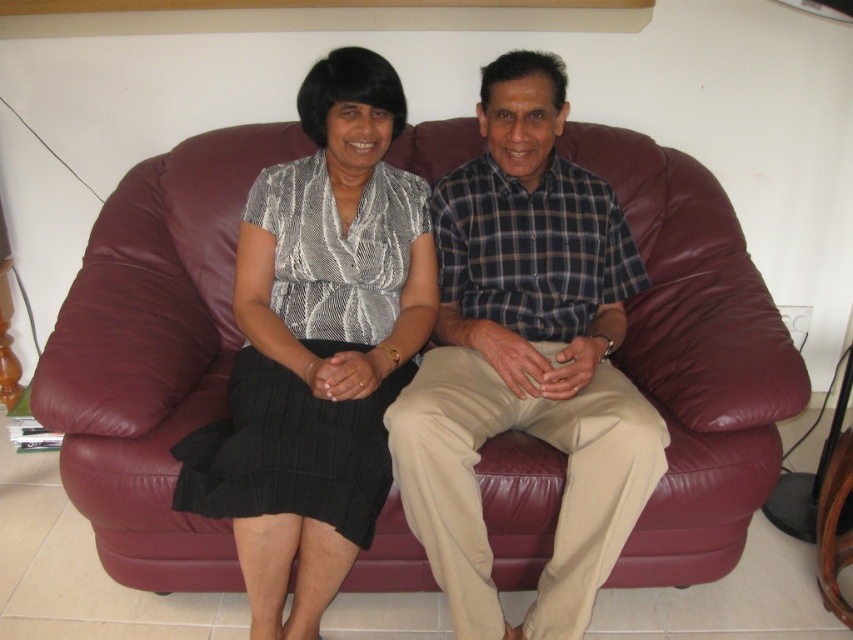
Question: Is plaid cotton shirt at center thinner than matte black dress at center?

Choices:
 (A) yes
 (B) no

Answer: (B)

Question: Estimate the real-world distances between objects in this image. Which object is closer to the matte black dress at center?

Choices:
 (A) maroon leather couch at center
 (B) plaid cotton shirt at center

Answer: (B)

Question: Estimate the real-world distances between objects in this image. Which object is closer to the matte black dress at center?

Choices:
 (A) plaid cotton shirt at center
 (B) maroon leather couch at center

Answer: (A)

Question: Where is maroon leather couch at center located in relation to plaid cotton shirt at center in the image?

Choices:
 (A) above
 (B) below

Answer: (A)

Question: Does maroon leather couch at center appear under plaid cotton shirt at center?

Choices:
 (A) no
 (B) yes

Answer: (A)

Question: Considering the real-world distances, which object is closest to the plaid cotton shirt at center?

Choices:
 (A) matte black dress at center
 (B) maroon leather couch at center

Answer: (B)